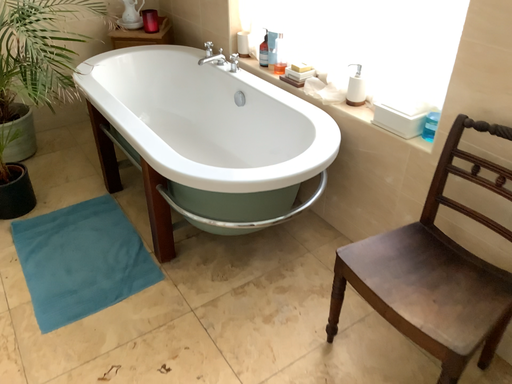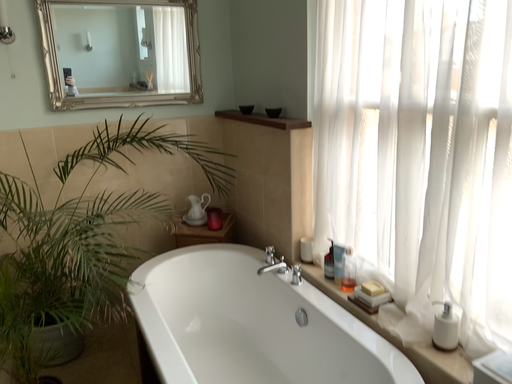
Question: How did the camera likely rotate when shooting the video?

Choices:
 (A) rotated left
 (B) rotated right

Answer: (A)